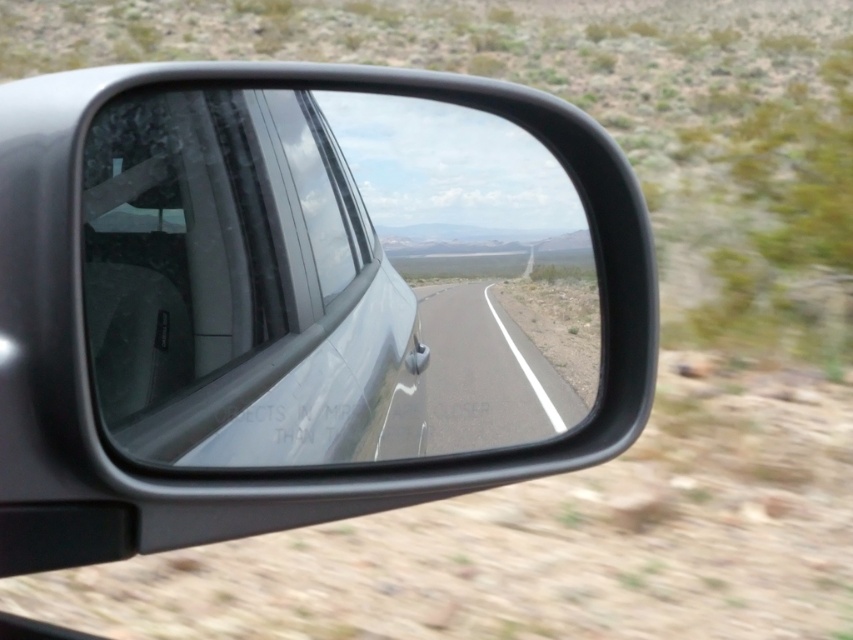
Question: Which of the following is the farthest from the observer?

Choices:
 (A) (309, 461)
 (B) (573, 396)

Answer: (B)

Question: Observing the image, what is the correct spatial positioning of clear glass window at center in reference to asphalt road at center?

Choices:
 (A) above
 (B) below

Answer: (A)

Question: Is clear glass window at center closer to the viewer compared to asphalt road at center?

Choices:
 (A) yes
 (B) no

Answer: (A)

Question: Which point is farther to the camera?

Choices:
 (A) (175, 307)
 (B) (425, 300)

Answer: (B)

Question: Is clear glass window at center further to camera compared to asphalt road at center?

Choices:
 (A) no
 (B) yes

Answer: (A)